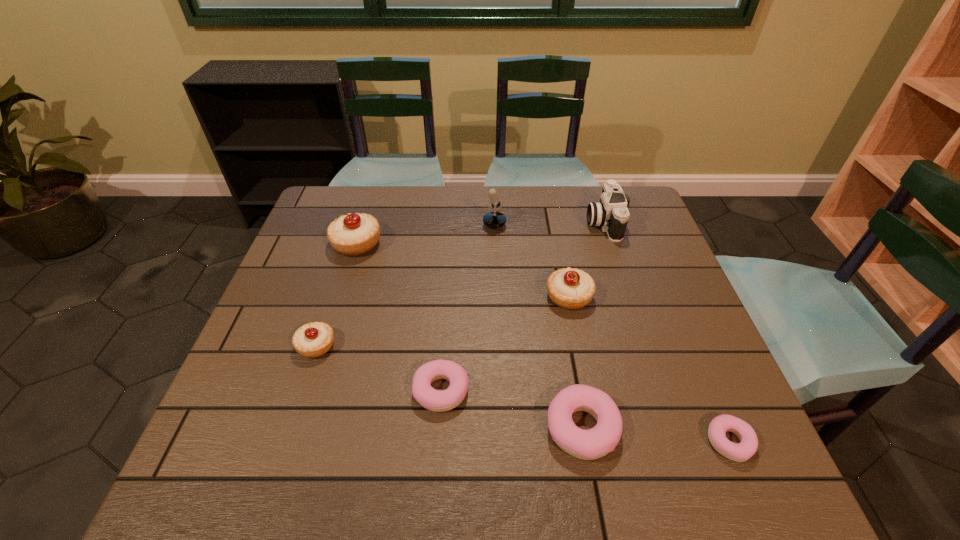
The image size is (960, 540). In order to click on microphone in this screenshot , I will do `click(495, 219)`.

Find the location of `camera`. camera is located at coordinates (611, 213).

You are a GUI agent. You are given a task and a screenshot of the screen. Output one action in this format:
    pyautogui.click(x=<x>, y=<y>)
    Task: Click on the seventh object from left to right
    This screenshot has height=540, width=960.
    Given the screenshot: What is the action you would take?
    pyautogui.click(x=611, y=213)

Image resolution: width=960 pixels, height=540 pixels. Identify the location of the farthest beige pastry. coord(354,234).

Locate an element on the screen. This screenshot has height=540, width=960. the farthest pastry is located at coordinates (354, 234).

Identify the location of the second nearest beige pastry. (569, 288).

Where is `the fifth shortest pastry`? The width and height of the screenshot is (960, 540). the fifth shortest pastry is located at coordinates (569, 288).

At what (x,y) coordinates should I click in order to perform the action: click on the third farthest pastry. Please return your answer as a coordinate pair (x, y). The image size is (960, 540). Looking at the image, I should click on (312, 340).

Locate an element on the screen. Image resolution: width=960 pixels, height=540 pixels. the fourth shortest object is located at coordinates (312, 340).

Locate an element on the screen. The image size is (960, 540). the third shortest pastry is located at coordinates (590, 444).